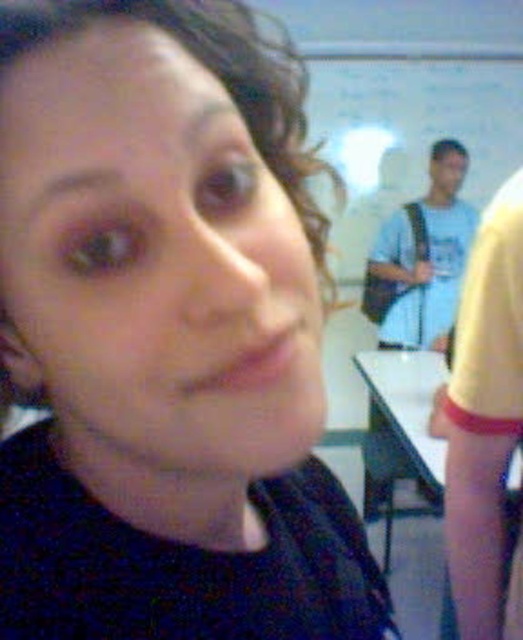
Does whiteboard at upper center have a smaller size compared to yellow fabric at right?

Actually, whiteboard at upper center might be larger than yellow fabric at right.

Image resolution: width=523 pixels, height=640 pixels. What are the coordinates of `whiteboard at upper center` in the screenshot? It's located at (408, 132).

Based on the photo, between whiteboard at upper center and light blue t-shirt at upper right, which one appears on the right side from the viewer's perspective?

From the viewer's perspective, whiteboard at upper center appears more on the right side.

Between whiteboard at upper center and light blue t-shirt at upper right, which one is positioned lower?

light blue t-shirt at upper right is below.

The width and height of the screenshot is (523, 640). I want to click on whiteboard at upper center, so click(x=408, y=132).

The width and height of the screenshot is (523, 640). I want to click on whiteboard at upper center, so click(x=408, y=132).

Does yellow fabric at right appear over light blue t-shirt at upper right?

Incorrect, yellow fabric at right is not positioned above light blue t-shirt at upper right.

Can you confirm if yellow fabric at right is taller than light blue t-shirt at upper right?

No.

The width and height of the screenshot is (523, 640). What do you see at coordinates (485, 422) in the screenshot? I see `yellow fabric at right` at bounding box center [485, 422].

The image size is (523, 640). What are the coordinates of `yellow fabric at right` in the screenshot? It's located at (485, 422).